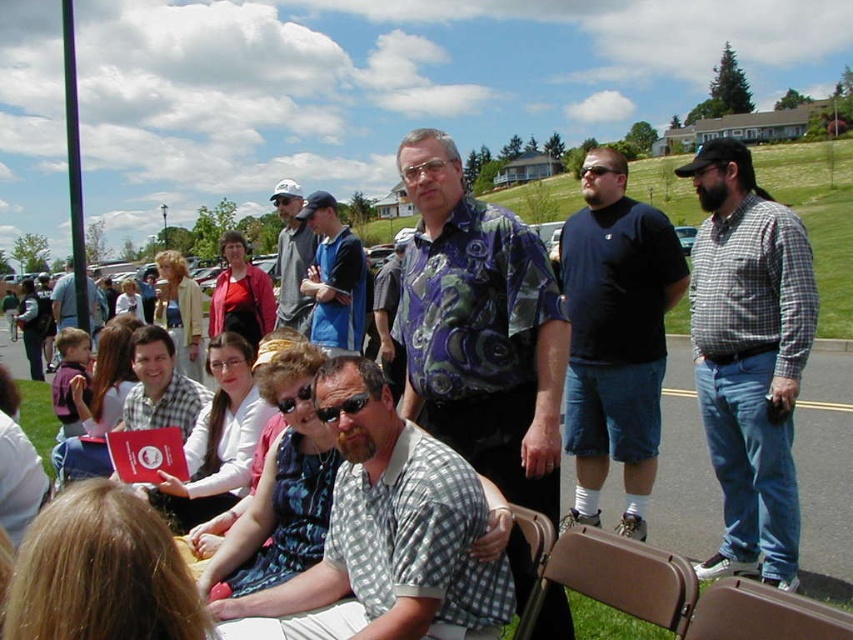
Question: Can you confirm if checkered fabric shirt at right is positioned above gray knit cap at center?

Choices:
 (A) yes
 (B) no

Answer: (B)

Question: Which point is closer to the camera?

Choices:
 (A) checkered fabric shirt at right
 (B) checkered fabric shirt at center
 (C) blue cotton shirt at center
 (D) gray knit cap at center

Answer: (B)

Question: From the image, what is the correct spatial relationship of blue cotton shirt at center in relation to brown fabric chair at lower center?

Choices:
 (A) right
 (B) left

Answer: (B)

Question: Is brown plastic chair at lower right bigger than brown fabric chair at lower center?

Choices:
 (A) yes
 (B) no

Answer: (A)

Question: Which of the following is the closest to the observer?

Choices:
 (A) matte black shirt at center
 (B) blue paisley shirt at center
 (C) dark blue t-shirt at center

Answer: (B)

Question: Which is farther from the blue paisley shirt at center?

Choices:
 (A) sunglasses at center
 (B) blue cotton shirt at center
 (C) dark blue t-shirt at center
 (D) tan fabric chair at lower center

Answer: (B)